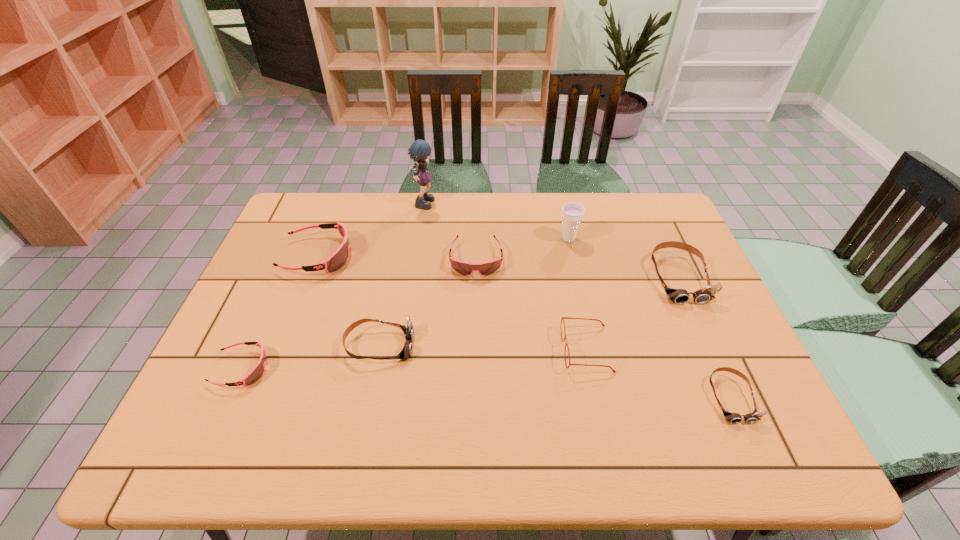
The width and height of the screenshot is (960, 540). I want to click on free spot at the far edge of the desktop, so click(516, 203).

This screenshot has height=540, width=960. I want to click on free location at the near edge of the desktop, so click(591, 431).

In the image, there is a desktop. Identify the location of vacant space at the left edge. (225, 377).

In the image, there is a desktop. At what (x,y) coordinates should I click in order to perform the action: click on blank space at the right edge. Please return your answer as a coordinate pair (x, y). Looking at the image, I should click on (704, 325).

Where is `vacant space at the far left corner of the desktop`? vacant space at the far left corner of the desktop is located at coordinates (336, 206).

The image size is (960, 540). Identify the location of free point between the fourth goggles from left to right and the smallest brown goggles. (603, 328).

What are the coordinates of `vacant space in between the biggest pink goggles and the nearest brown goggles` in the screenshot? It's located at (524, 327).

Locate an element on the screen. vacant area between the spectacles and the cup is located at coordinates (577, 294).

I want to click on vacant space in between the smallest brown goggles and the biggest brown goggles, so (705, 338).

Where is `free spot between the blue rag doll and the purple cup`? The image size is (960, 540). free spot between the blue rag doll and the purple cup is located at coordinates (496, 220).